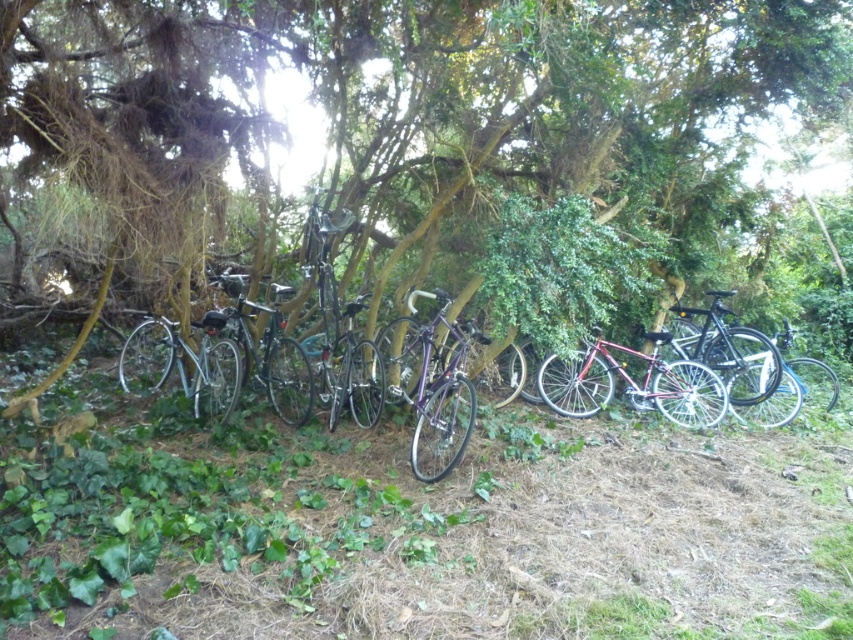
You are standing at the base of the large tree and want to retrieve your shiny black mountain bike at center and shiny silver bicycle at right. Which bike do you need to move first to access the one behind it?

The shiny black mountain bike at center is located above the shiny silver bicycle at right, so you need to move the shiny black mountain bike at center first to access the one behind it.

From the picture: You are a delivery person who needs to park your bike in a tight space. You see a shiny red bicycle at center and a shiny black mountain bike at center. Which bike would be easier to fit into a small parking area?

The shiny red bicycle at center occupies less space than the shiny black mountain bike at center, so it would be easier to fit into a small parking area.